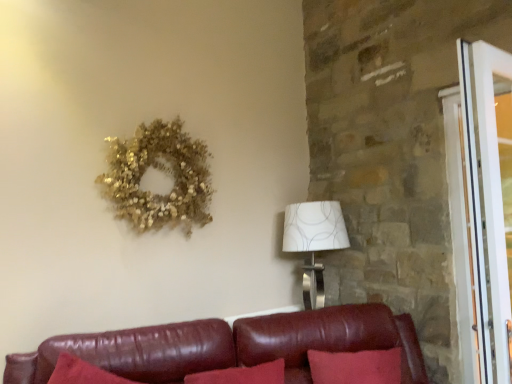
Question: From a real-world perspective, is gold glittery wreath at upper left below leather couch at lower center?

Choices:
 (A) no
 (B) yes

Answer: (A)

Question: Is leather couch at lower center inside gold glittery wreath at upper left?

Choices:
 (A) no
 (B) yes

Answer: (A)

Question: From the image's perspective, is gold glittery wreath at upper left located beneath leather couch at lower center?

Choices:
 (A) yes
 (B) no

Answer: (B)

Question: Considering the relative positions of gold glittery wreath at upper left and leather couch at lower center in the image provided, is gold glittery wreath at upper left to the right of leather couch at lower center from the viewer's perspective?

Choices:
 (A) yes
 (B) no

Answer: (B)

Question: From the image's perspective, is gold glittery wreath at upper left over leather couch at lower center?

Choices:
 (A) no
 (B) yes

Answer: (B)

Question: Is leather couch at lower center inside or outside of white textured lampshade at right?

Choices:
 (A) inside
 (B) outside

Answer: (B)

Question: Is point (315, 331) positioned closer to the camera than point (307, 213)?

Choices:
 (A) closer
 (B) farther

Answer: (A)

Question: In terms of size, does leather couch at lower center appear bigger or smaller than white textured lampshade at right?

Choices:
 (A) big
 (B) small

Answer: (A)

Question: From the image's perspective, is leather couch at lower center located above or below white textured lampshade at right?

Choices:
 (A) below
 (B) above

Answer: (A)

Question: Do you think leather couch at lower center is within white glossy screen door at right, or outside of it?

Choices:
 (A) inside
 (B) outside

Answer: (B)

Question: Looking at the image, does leather couch at lower center seem bigger or smaller compared to white glossy screen door at right?

Choices:
 (A) big
 (B) small

Answer: (A)

Question: Is point (156, 377) positioned closer to the camera than point (474, 178)?

Choices:
 (A) closer
 (B) farther

Answer: (B)

Question: From a real-world perspective, is leather couch at lower center positioned above or below white glossy screen door at right?

Choices:
 (A) below
 (B) above

Answer: (A)

Question: Considering their positions, is leather couch at lower center located in front of or behind gold glittery wreath at upper left?

Choices:
 (A) front
 (B) behind

Answer: (A)

Question: From a real-world perspective, is leather couch at lower center positioned above or below gold glittery wreath at upper left?

Choices:
 (A) below
 (B) above

Answer: (A)